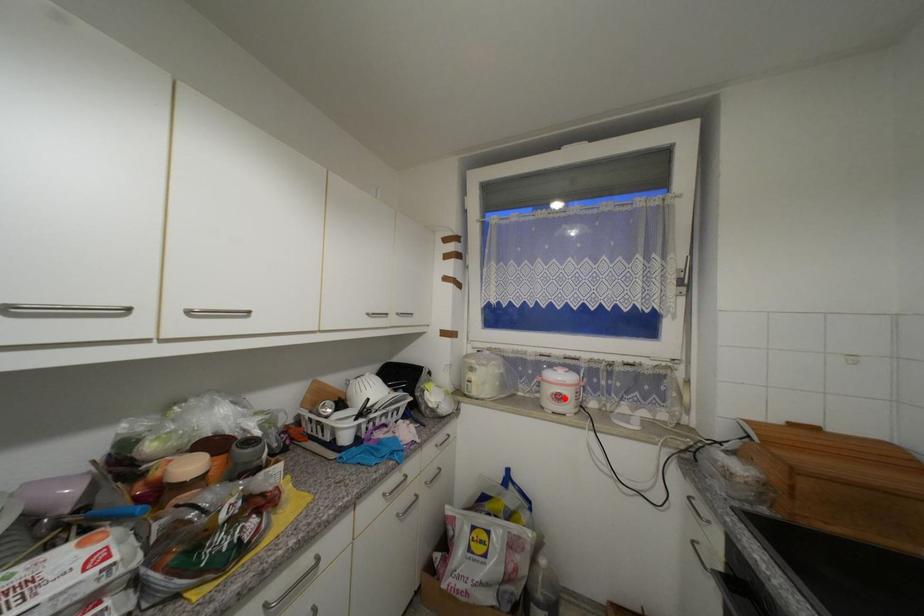
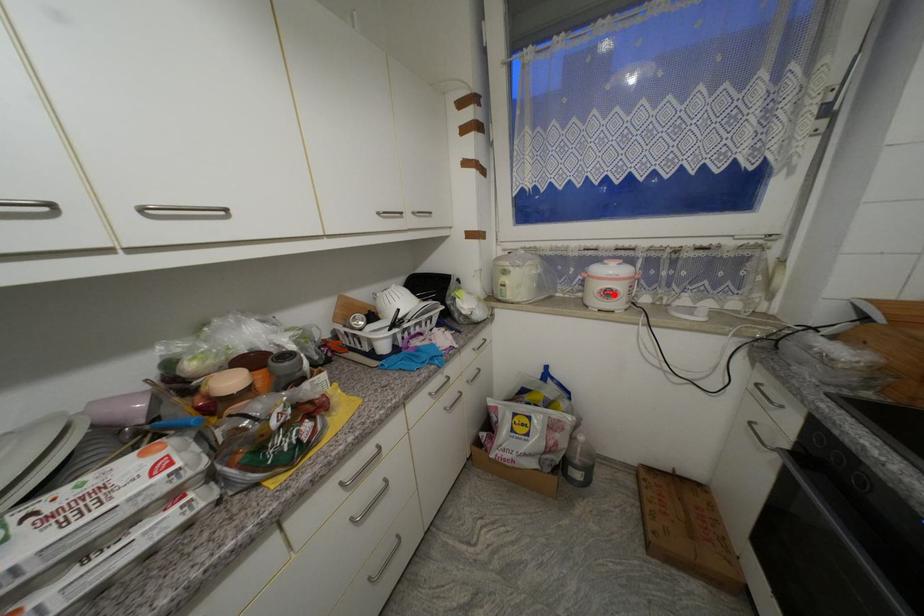
I am providing you with two images of the same scene from different viewpoints. A red point is marked on the first image and another point is marked on the second image. Is the red point in image1 aligned with the point shown in image2?

Yes